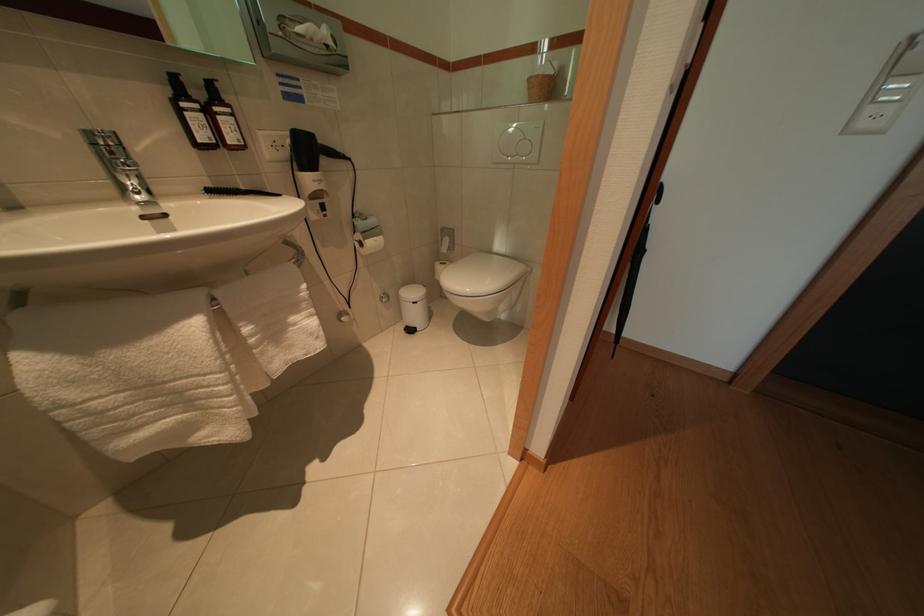
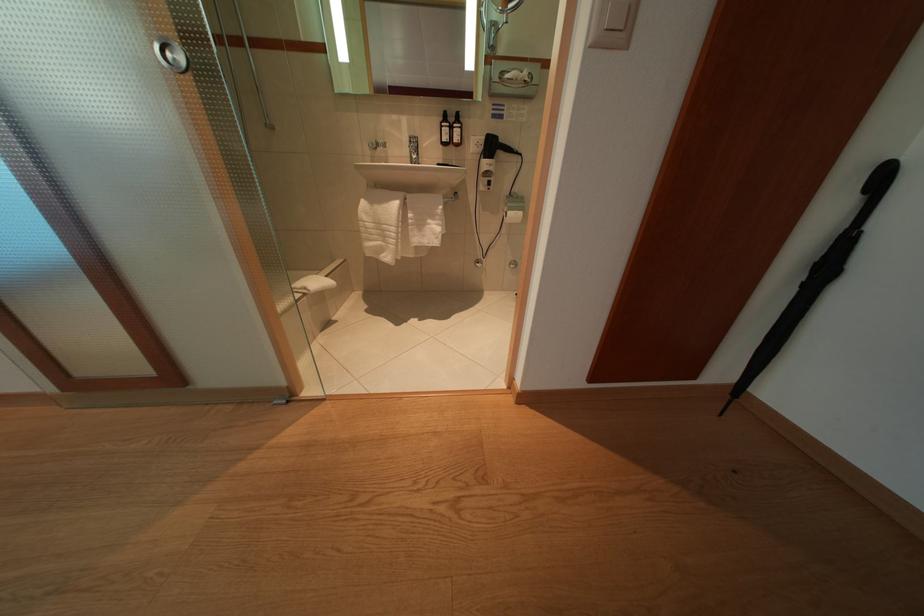
The point at (378,249) is marked in the first image. Where is the corresponding point in the second image?

(517, 219)